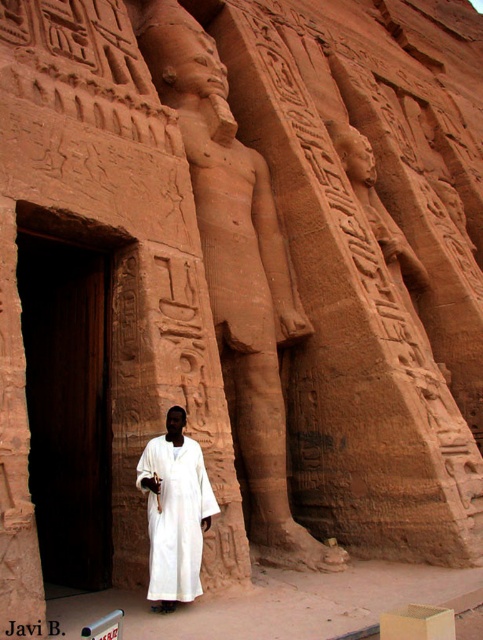
You are an archaeologist exploring the temple. You see a dark wood door at left and a white cotton robe at center. Which object is higher in the scene?

The dark wood door at left is higher than the white cotton robe at center.